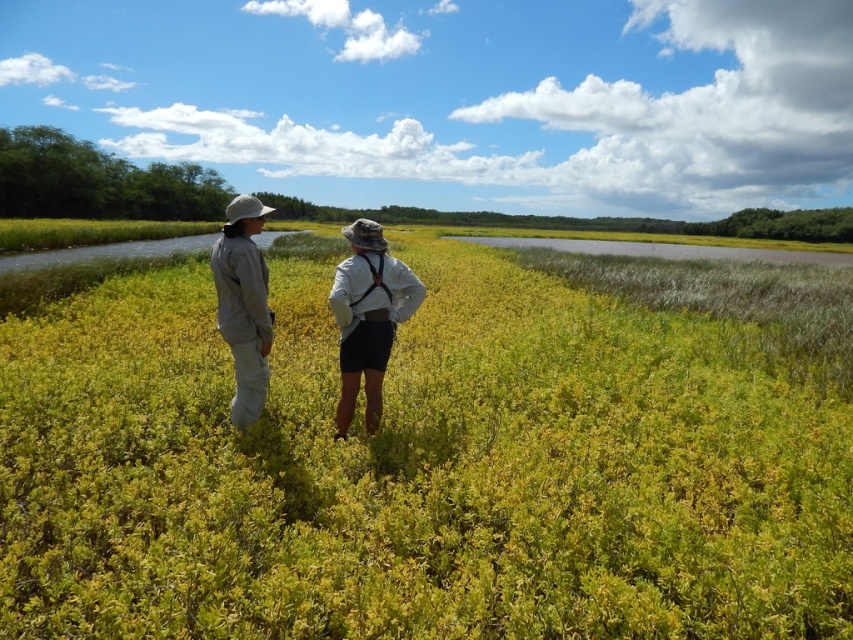
Who is positioned more to the right, khaki fabric pants at center or white cotton shirt at center?

From the viewer's perspective, white cotton shirt at center appears more on the right side.

Who is shorter, khaki fabric pants at center or white cotton shirt at center?

Standing shorter between the two is khaki fabric pants at center.

Where is `khaki fabric pants at center`? The width and height of the screenshot is (853, 640). khaki fabric pants at center is located at coordinates (242, 305).

Is green leafy grass at center further to camera compared to white cotton shirt at center?

No.

Between point (532, 620) and point (380, 298), which one is positioned behind?

The point (380, 298) is more distant.

Locate an element on the screen. The image size is (853, 640). green leafy grass at center is located at coordinates (415, 472).

Does green leafy grass at center have a larger size compared to gray fabric jacket at left?

Yes, green leafy grass at center is bigger than gray fabric jacket at left.

Is green leafy grass at center thinner than gray fabric jacket at left?

No, green leafy grass at center is not thinner than gray fabric jacket at left.

Between point (827, 572) and point (258, 365), which one is positioned in front?

Point (827, 572) is in front.

The image size is (853, 640). What are the coordinates of `green leafy grass at center` in the screenshot? It's located at (415, 472).